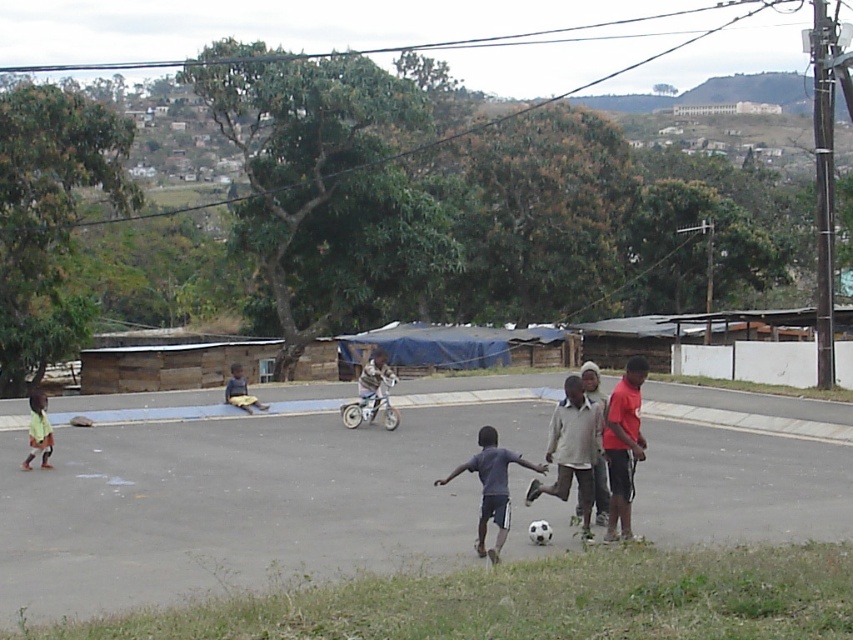
You are a photographer standing at the edge of the playing area. You want to take a photo that includes both the point at (x=480, y=492) and the point at (x=39, y=408). Which point should you focus on first to ensure both are in the frame?

You should focus on the point at (x=39, y=408) first because it is behind the point at (x=480, y=492). By focusing on the farther point, you can ensure both are within the depth of field and in focus.

You are a photographer trying to capture a photo of the red cotton shirt at right and the dark blue jersey at center. Based on their positions, which one is higher up in the image?

The red cotton shirt at right is above the dark blue jersey at center, so it is higher up in the image.

You are a photographer standing at the edge of the paved area. You want to take a photo that includes both the dark blue jersey at center and the light brown wooden bench at center. Given that your camera has a maximum focus range of 10 meters, will you be able to capture both objects clearly in the same frame?

The dark blue jersey at center and the light brown wooden bench at center are 12.92 meters apart. Since your camera can only focus up to 10 meters, capturing both clearly in the same frame may be challenging as the distance between them exceeds the focus range.